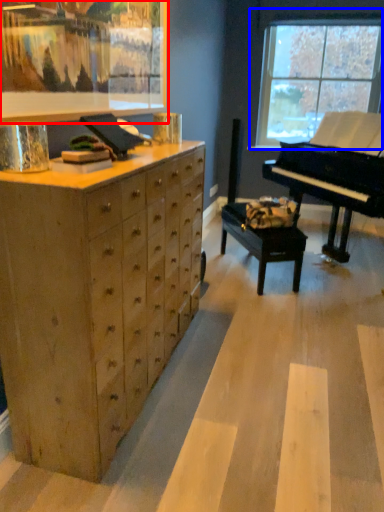
Question: Which point is closer to the camera, picture frame (highlighted by a red box) or window (highlighted by a blue box)?

Choices:
 (A) picture frame
 (B) window

Answer: (A)